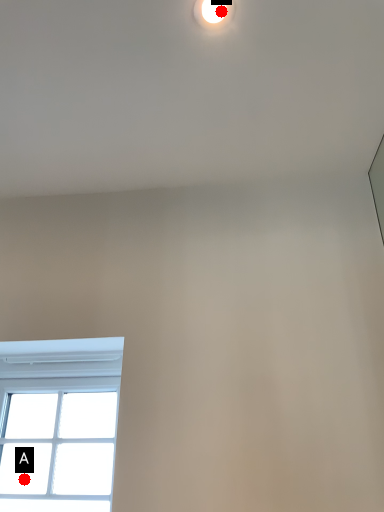
Question: Two points are circled on the image, labeled by A and B beside each circle. Which point is closer to the camera?

Choices:
 (A) A is closer
 (B) B is closer

Answer: (B)